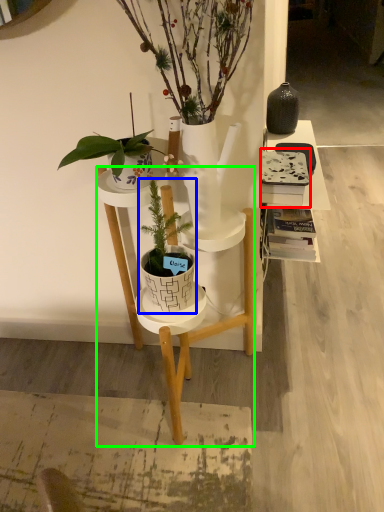
Question: Based on their relative distances, which object is farther from book (highlighted by a red box)? Choose from houseplant (highlighted by a blue box) and desk (highlighted by a green box).

Choices:
 (A) houseplant
 (B) desk

Answer: (A)